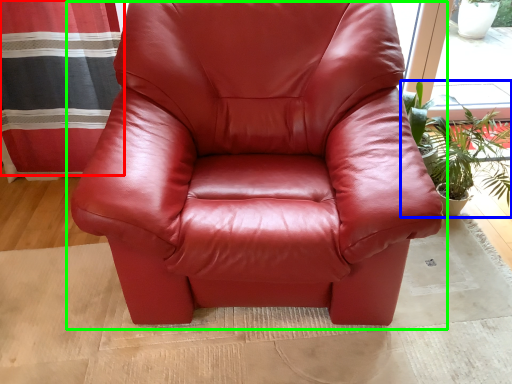
Question: Which object is positioned closest to curtain (highlighted by a red box)? Select from houseplant (highlighted by a blue box) and chair (highlighted by a green box).

Choices:
 (A) houseplant
 (B) chair

Answer: (B)